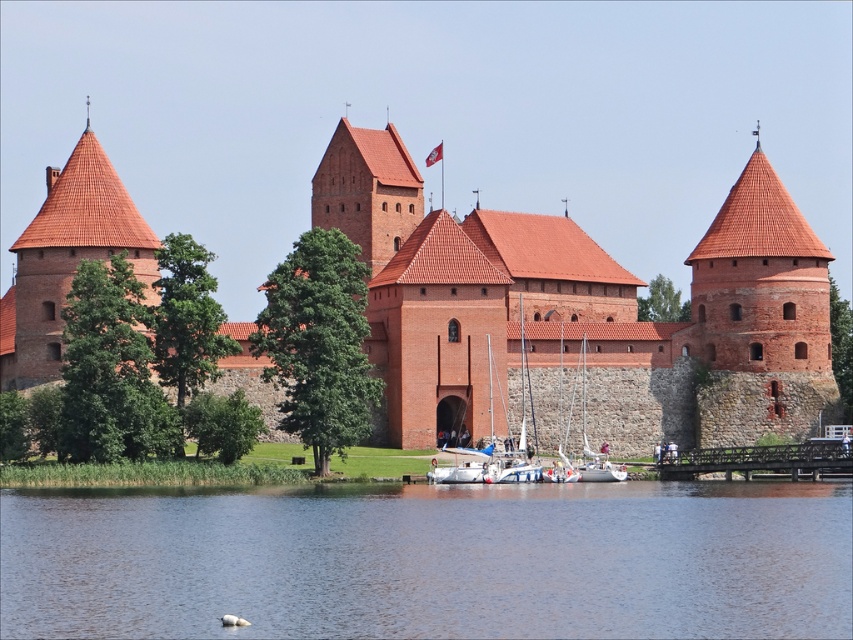
Is transparent water at lower center wider than white sailboat at center?

Yes.

Is transparent water at lower center further to camera compared to white sailboat at center?

No, transparent water at lower center is closer to the viewer.

Is point (79, 595) farther from camera compared to point (624, 468)?

No, (79, 595) is in front of (624, 468).

Locate an element on the screen. transparent water at lower center is located at coordinates (432, 563).

Between brick tower at left and white sailboat at center, which one has more height?

Standing taller between the two is brick tower at left.

Between point (149, 228) and point (590, 480), which one is positioned behind?

Point (149, 228)

At what (x,y) coordinates should I click in order to perform the action: click on brick tower at left. Please return your answer as a coordinate pair (x, y). The height and width of the screenshot is (640, 853). Looking at the image, I should click on (67, 259).

Between transparent water at lower center and brick tower at left, which one is positioned higher?

brick tower at left

How distant is transparent water at lower center from brick tower at left?

101.19 feet

Does point (119, 497) come closer to viewer compared to point (105, 193)?

Yes, point (119, 497) is in front of point (105, 193).

Where is `transparent water at lower center`? transparent water at lower center is located at coordinates (432, 563).